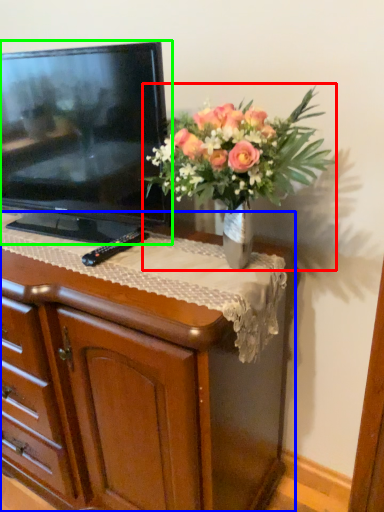
Question: Considering the real-world distances, which object is farthest from houseplant (highlighted by a red box)? chest of drawers (highlighted by a blue box) or television (highlighted by a green box)?

Choices:
 (A) chest of drawers
 (B) television

Answer: (A)